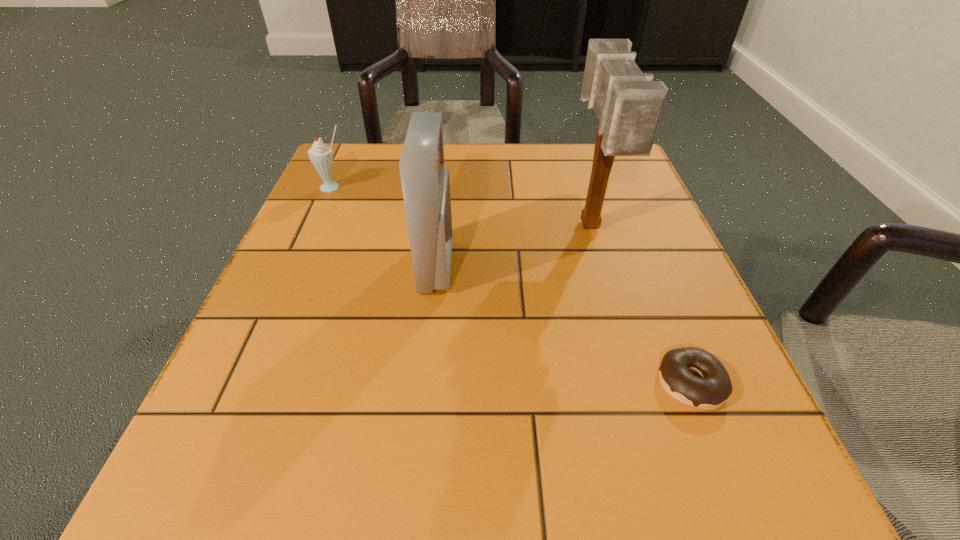
Locate an element on the screen. The image size is (960, 540). free space that satisfies the following two spatial constraints: 1. on the straw side of the doughnut; 2. on the left side of the leftmost object is located at coordinates (249, 383).